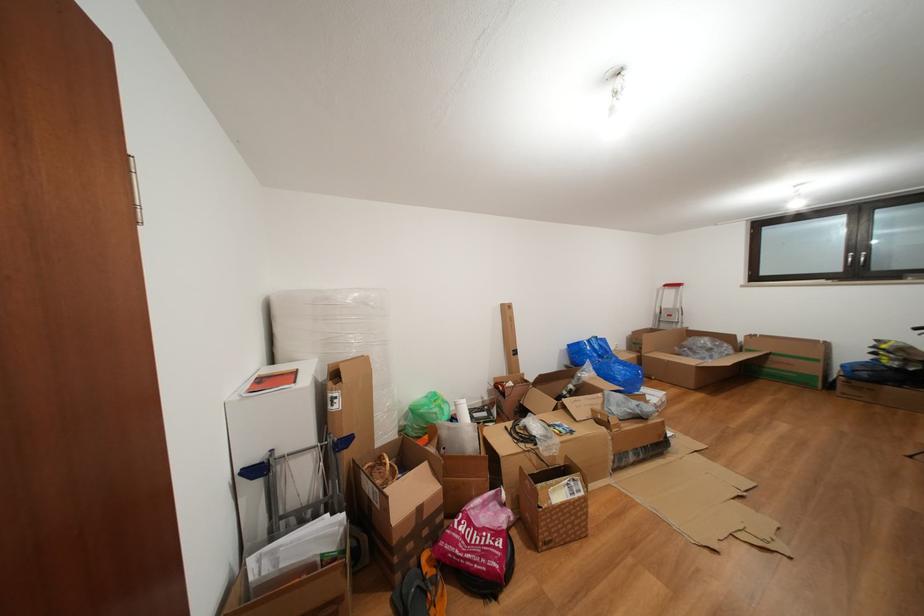
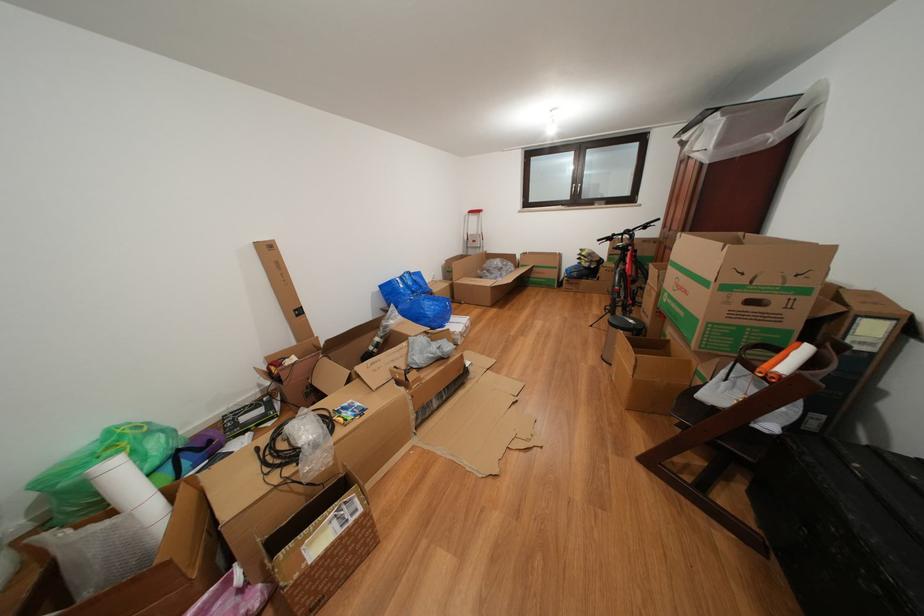
Locate, in the second image, the point that corresponds to (724,361) in the first image.

(513, 280)